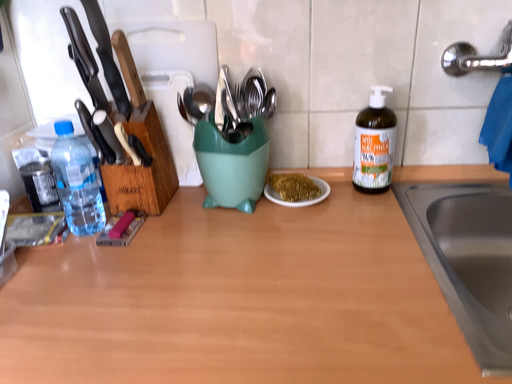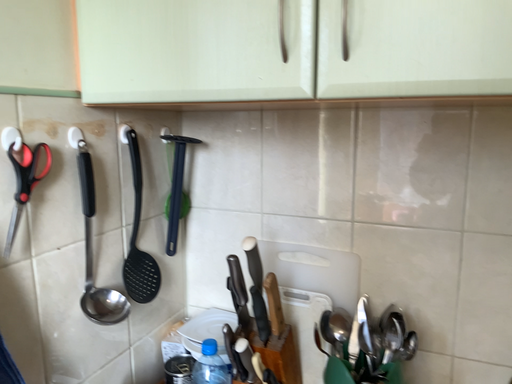
Question: Which way did the camera rotate in the video?

Choices:
 (A) rotated downward
 (B) rotated upward

Answer: (B)